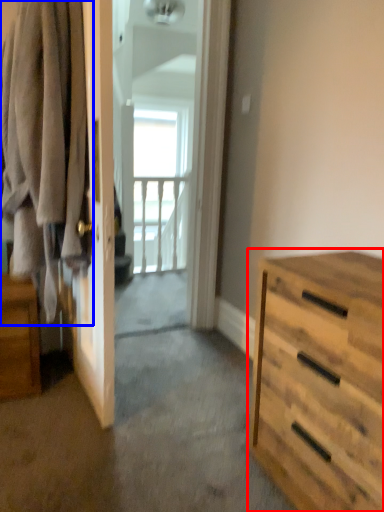
Question: Which of the following is the farthest to the observer, chest of drawers (highlighted by a red box) or clothing (highlighted by a blue box)?

Choices:
 (A) chest of drawers
 (B) clothing

Answer: (B)